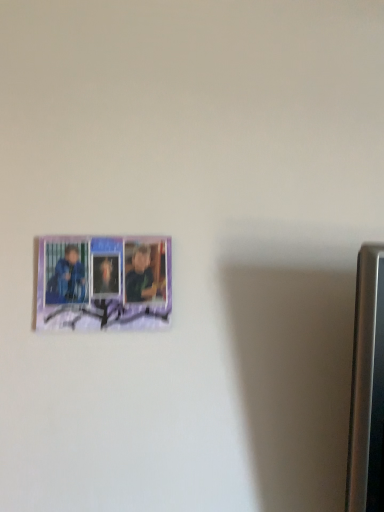
Where is `purple matte picture frame at upper left`? Image resolution: width=384 pixels, height=512 pixels. purple matte picture frame at upper left is located at coordinates (104, 282).

What is the approximate width of purple matte picture frame at upper left?

1.04 inches.

What is the approximate height of purple matte picture frame at upper left?

9.73 inches.

This screenshot has height=512, width=384. What do you see at coordinates (104, 282) in the screenshot?
I see `purple matte picture frame at upper left` at bounding box center [104, 282].

Identify the location of purple matte picture frame at upper left. (104, 282).